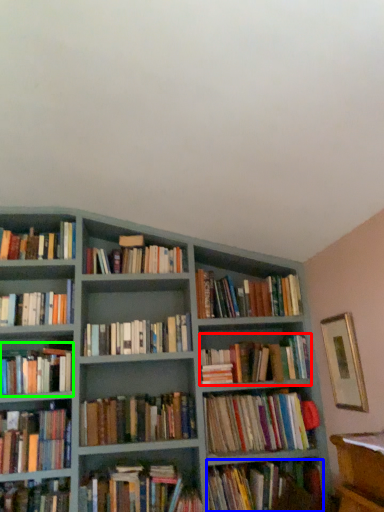
Question: Estimate the real-world distances between objects in this image. Which object is farther from book (highlighted by a red box), book (highlighted by a blue box) or book (highlighted by a green box)?

Choices:
 (A) book
 (B) book

Answer: (B)